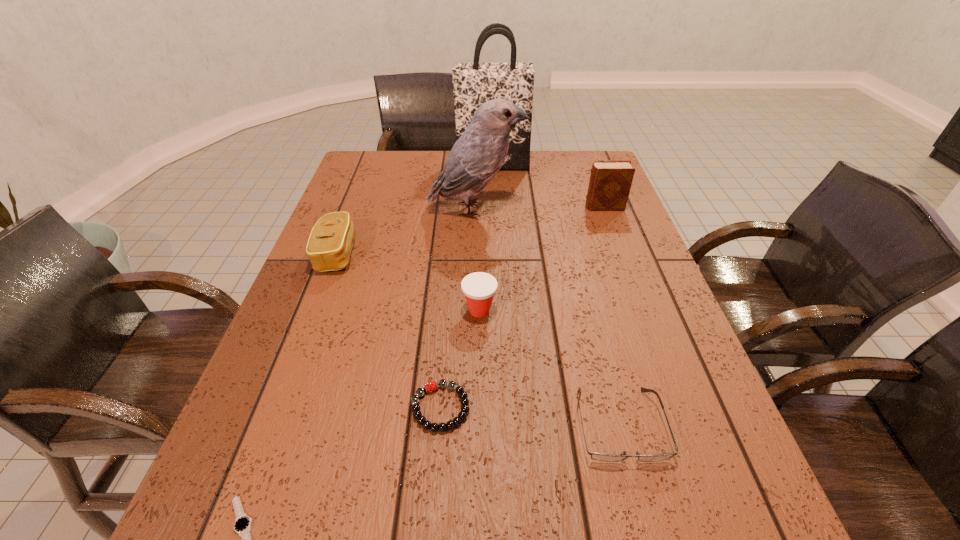
Find the location of a particular element. Image resolution: width=960 pixels, height=540 pixels. empty space that is in between the sixth tallest object and the fourth farthest object is located at coordinates (478, 339).

This screenshot has height=540, width=960. I want to click on vacant area that lies between the Dixie cup and the seventh tallest object, so click(460, 359).

Choose which object is the third nearest neighbor to the tallest object. Please provide its 2D coordinates. Your answer should be formatted as a tuple, i.e. [(x, y)], where the tuple contains the x and y coordinates of a point satisfying the conditions above.

[(329, 246)]

You are a GUI agent. You are given a task and a screenshot of the screen. Output one action in this format:
    pyautogui.click(x=<x>, y=<y>)
    Task: Click on the object that is the fourth closest to the diary
    The image size is (960, 540).
    Given the screenshot: What is the action you would take?
    pyautogui.click(x=595, y=456)

At what (x,y) coordinates should I click in order to perform the action: click on free space that satisfies the following two spatial constraints: 1. on the spine side of the diary; 2. on the front-facing side of the spectacles. Please return your answer as a coordinate pair (x, y). This screenshot has height=540, width=960. Looking at the image, I should click on (686, 424).

In order to click on vacant region that satisfies the following two spatial constraints: 1. on the front-facing side of the parrot; 2. on the left side of the Dixie cup in this screenshot , I will do `click(473, 310)`.

Image resolution: width=960 pixels, height=540 pixels. I want to click on vacant space that satisfies the following two spatial constraints: 1. on the zipper side of the fourth farthest object; 2. on the right side of the bracelet, so click(x=278, y=407).